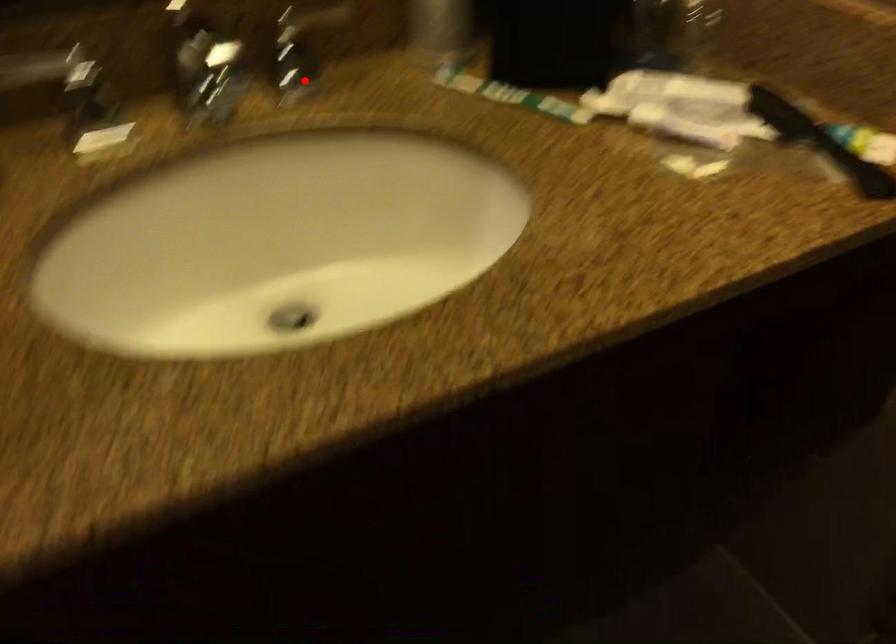
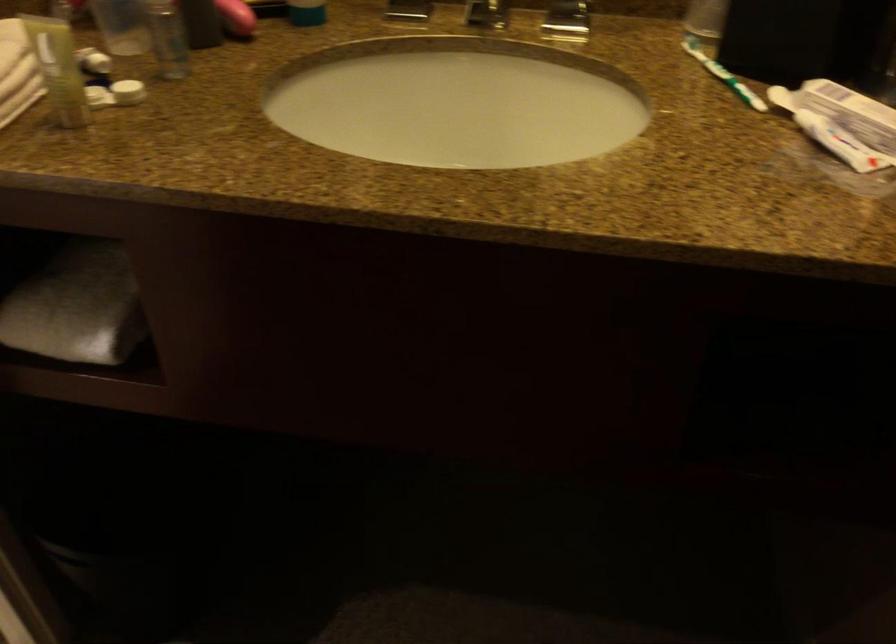
Where in the second image is the point corresponding to the highlighted location from the first image?

(566, 21)